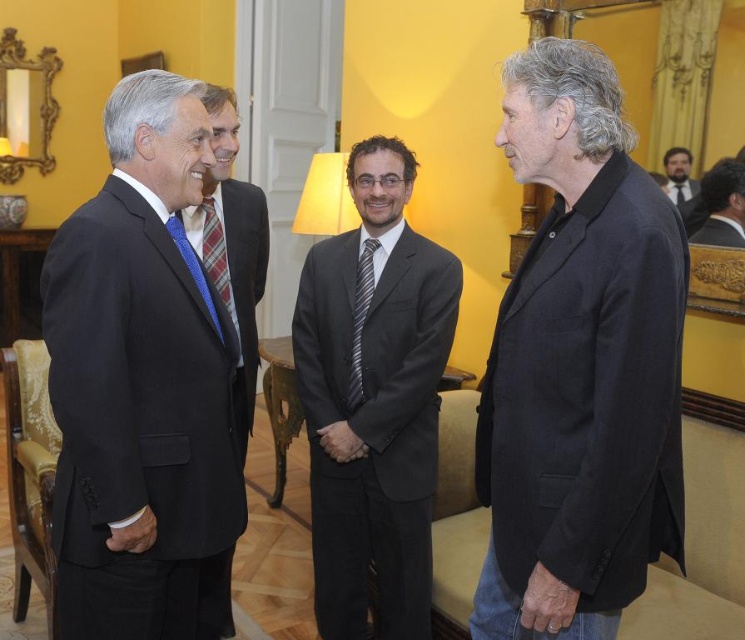
From the picture: You are standing in the room and want to hand a gift to the person with the striped fabric tie at center. Which direction should you move to reach that person?

The striped fabric tie at center is located at point (x=361, y=317), so you should move towards the center of the room to reach the person wearing it.

You are organizing a charity event and need to ensure that the seating arrangement accommodates the physical dimensions of the attendees. Given that the matte black suit at left and the black silk suit at upper right are worn by two guests, which guest requires a larger seat based on their attire?

The matte black suit at left requires a larger seat because it has a larger size compared to the black silk suit at upper right.